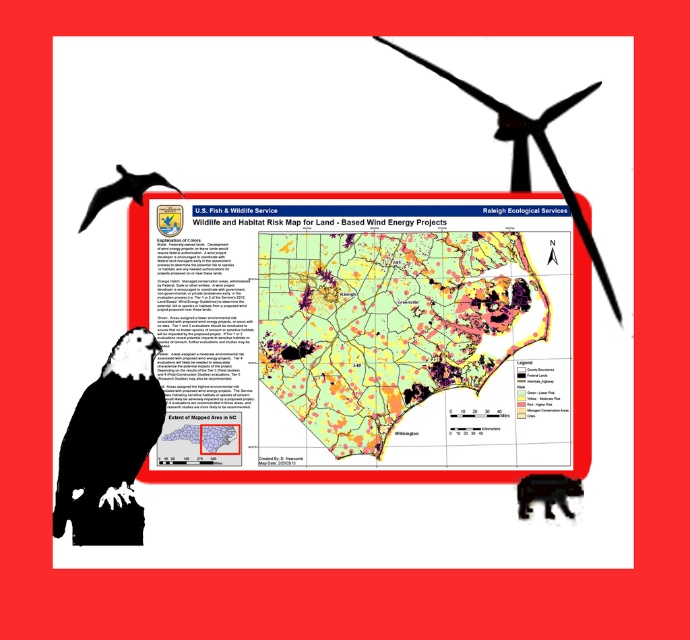
Between point (155, 413) and point (150, 184), which one is positioned in front?

Point (155, 413) is more forward.

Does black matte eagle at lower left have a greater width compared to silhouette glossy eagle at lower left?

Yes, black matte eagle at lower left is wider than silhouette glossy eagle at lower left.

Which is in front, point (90, 518) or point (139, 182)?

Point (90, 518)

What are the coordinates of `black matte eagle at lower left` in the screenshot? It's located at (110, 445).

Does black matte eagle at lower left come behind black matte wind turbine at upper right?

No.

Does black matte eagle at lower left appear on the left side of black matte wind turbine at upper right?

Indeed, black matte eagle at lower left is positioned on the left side of black matte wind turbine at upper right.

Is point (150, 368) closer to viewer compared to point (611, 298)?

Yes, it is in front of point (611, 298).

Image resolution: width=690 pixels, height=640 pixels. Identify the location of black matte eagle at lower left. (110, 445).

Is black matte wind turbine at upper right to the left of black fur bear at lower left from the viewer's perspective?

Indeed, black matte wind turbine at upper right is positioned on the left side of black fur bear at lower left.

Between point (515, 157) and point (531, 493), which one is positioned behind?

Positioned behind is point (515, 157).

The image size is (690, 640). What are the coordinates of `black matte wind turbine at upper right` in the screenshot? It's located at (526, 150).